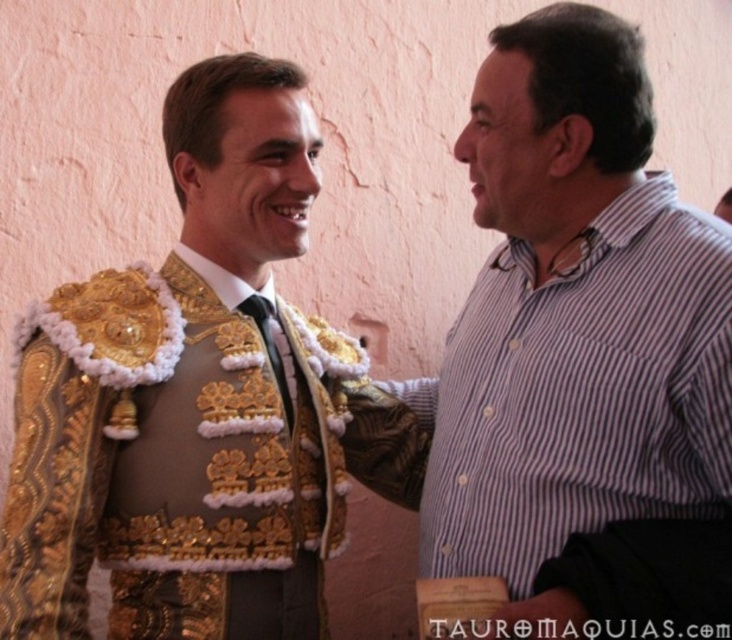
You are standing in front of the two men in the image. The gold embroidered jacket at left is located at point (195, 403). Can you tell me where the gold embroidered jacket at left is positioned relative to the striped shirt on the right?

The gold embroidered jacket at left is positioned at point (195, 403), which is to the left of the striped shirt on the right.

You are standing in front of the two men having a conversation. You notice two points marked on the wall behind them. The first point is at coordinates point (268,296) and the second point is at point (266,301). From your perspective, which point is closer to you?

Point (266,301) is closer to you because it is in front of point (268,296) according to their spatial arrangement.